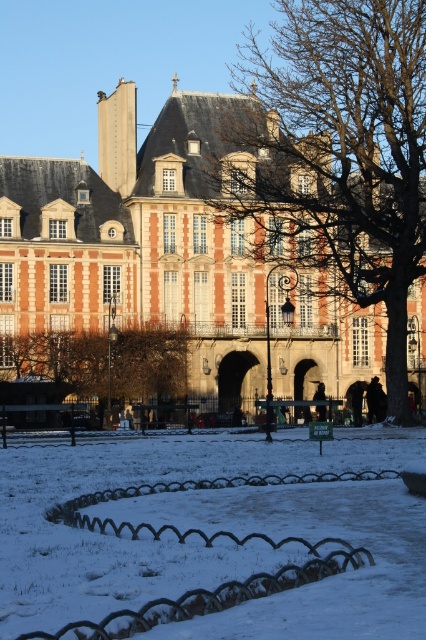
This screenshot has height=640, width=426. What do you see at coordinates (146, 540) in the screenshot? I see `white snow at center` at bounding box center [146, 540].

Where is `white snow at center`? white snow at center is located at coordinates (146, 540).

Which of these two, bare wood tree at center or brown textured tree at center, stands shorter?

brown textured tree at center is shorter.

Which is in front, point (383, 209) or point (19, 356)?

Positioned in front is point (19, 356).

I want to click on bare wood tree at center, so click(x=350, y=148).

Is matte brick building at center taller than brown textured tree at center?

Yes, matte brick building at center is taller than brown textured tree at center.

Between point (39, 195) and point (37, 416), which one is positioned in front?

Point (37, 416) is more forward.

Does point (11, 179) lie behind point (172, 380)?

No, it is in front of (172, 380).

I want to click on matte brick building at center, so click(183, 244).